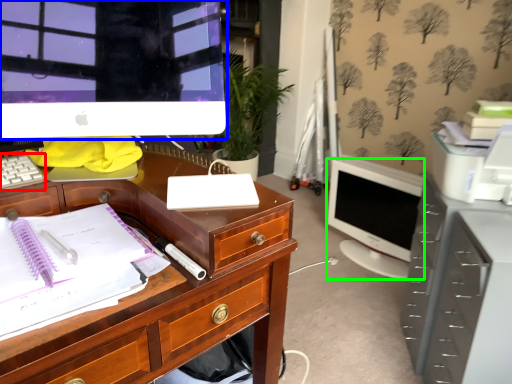
Question: Which is farther away from computer keyboard (highlighted by a red box)? computer monitor (highlighted by a blue box) or computer monitor (highlighted by a green box)?

Choices:
 (A) computer monitor
 (B) computer monitor

Answer: (B)